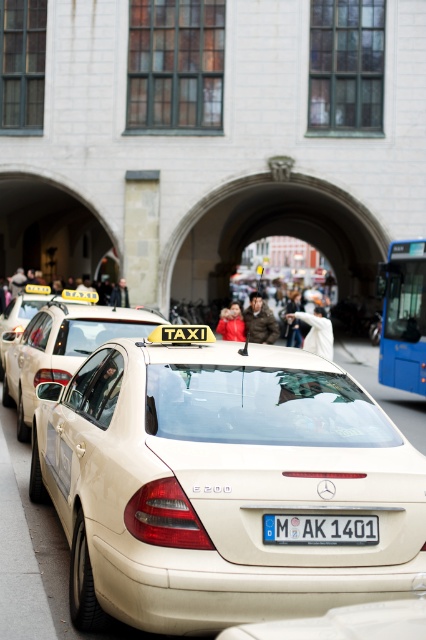
You are a pedestrian standing on the sidewalk and see the matte beige taxi at center and the beige matte taxi at center. Which one is closer to you?

Both the matte beige taxi at center and the beige matte taxi at center are the same object, so they are at the same distance from you.

You are a pedestrian standing at the crosswalk and want to hail a taxi. There is a beige matte taxi at center and a blue metallic bus at right. Which vehicle is closer to you?

The beige matte taxi at center is closer to you because the blue metallic bus at right is 7.01 meters away from it, meaning the taxi is nearer than the bus.

You are standing at the camera position and want to take a photo of the blue metallic bus at right. If your camera has a maximum focus range of 50 feet, will you be able to capture the bus clearly?

The blue metallic bus at right is 52.17 feet away from the camera, which exceeds the maximum focus range of 50 feet. Therefore, the camera will not be able to capture the bus clearly.